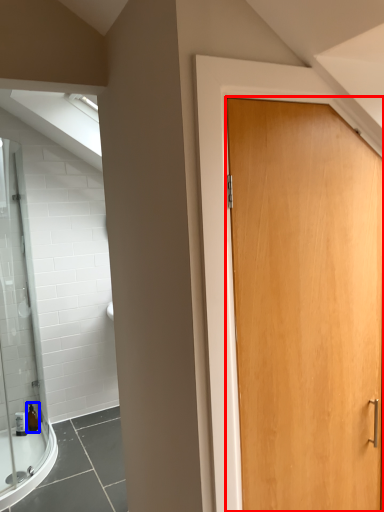
Question: Which point is closer to the camera, door (highlighted by a red box) or toiletry (highlighted by a blue box)?

Choices:
 (A) door
 (B) toiletry

Answer: (A)